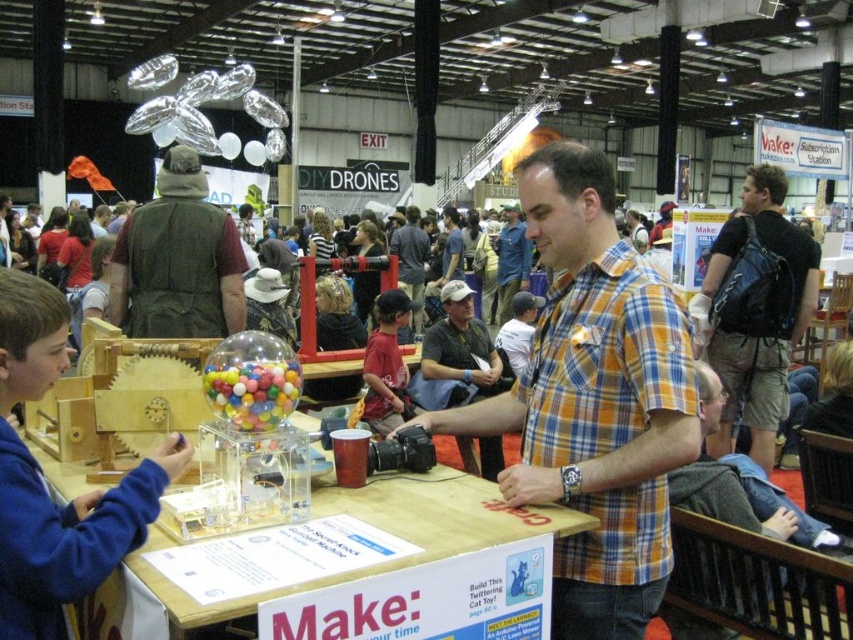
You are a photographer standing at the back of the exhibition hall. You need to take a clear photo of the plaid cotton shirt at center and the black leather backpack at right. Which object might block the view of the other when taking the photo?

The black leather backpack at right is taller than the plaid cotton shirt at center, so it might block the view of the plaid cotton shirt at center if positioned between the photographer and the shirt.

You are an attendee at the DIY event and want to take a photo of the plaid cotton shirt at center and the black leather backpack at right. If your camera can only capture objects within a 1.5 meter width, will both items fit in the frame?

The plaid cotton shirt at center is wider than the black leather backpack at right. However, without knowing the exact combined width of both items, it is impossible to determine if they will fit within the 1.5 meter camera frame. Additional measurements are needed.